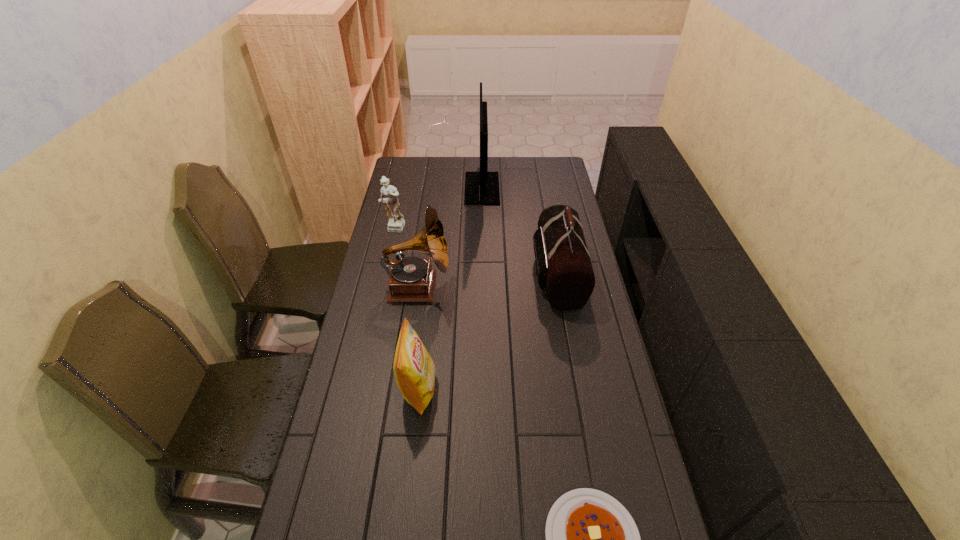
The width and height of the screenshot is (960, 540). In order to click on free space at the right edge in this screenshot , I will do `click(570, 387)`.

Find the location of `vacant space at the far right corner of the desktop`. vacant space at the far right corner of the desktop is located at coordinates (534, 166).

This screenshot has width=960, height=540. I want to click on free space between the duffel bag and the fifth farthest object, so pos(488,332).

This screenshot has height=540, width=960. What are the coordinates of `unoccupied position between the tallest object and the figurine` in the screenshot? It's located at (438, 209).

Find the location of a particular element. Image resolution: width=960 pixels, height=540 pixels. unoccupied area between the tallest object and the phonograph_record is located at coordinates (450, 238).

The image size is (960, 540). What are the coordinates of `vacant space that's between the figurine and the monitor` in the screenshot? It's located at (438, 209).

Locate an element on the screen. The image size is (960, 540). free space between the crisp (potato chip) and the duffel bag is located at coordinates (488, 332).

Identify which object is located as the fifth nearest to the fifth farthest object. Please provide its 2D coordinates. Your answer should be formatted as a tuple, i.e. [(x, y)], where the tuple contains the x and y coordinates of a point satisfying the conditions above.

[(481, 188)]

Where is `the fifth closest object to the figurine`? The height and width of the screenshot is (540, 960). the fifth closest object to the figurine is located at coordinates (591, 539).

Identify the location of free region that satisfies the following two spatial constraints: 1. on the screen side of the tallest object; 2. on the front-facing side of the figurine. This screenshot has height=540, width=960. (482, 230).